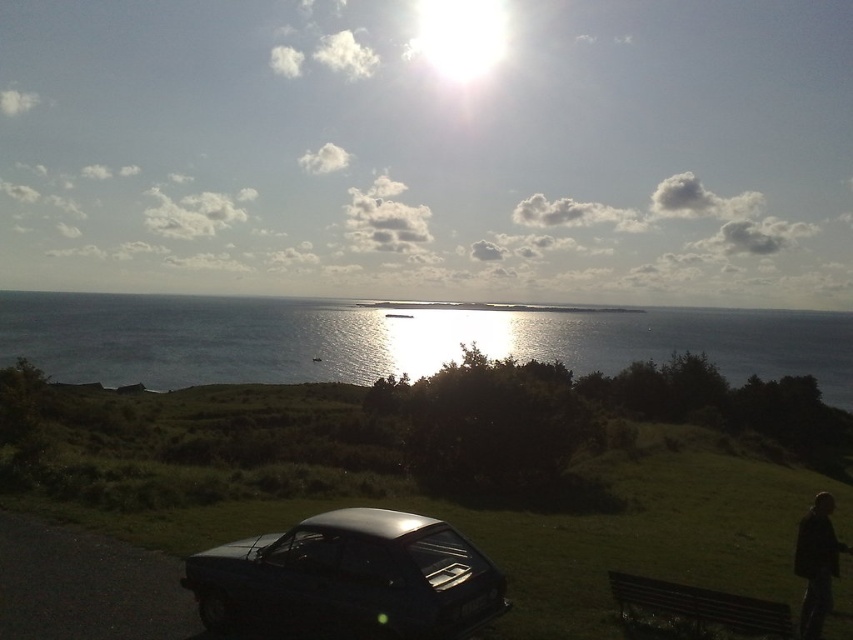
You are standing at the point marked by the coordinates point (393, 339) in the image. What do you see directly in front of you?

You see blue water at center directly in front of you at point (393, 339).

You are a photographer setting up a tripod to capture the sunset. You have a blue water at center and a dark brown wooden bench at lower right in your viewfinder. Which object should you focus on first if you want to ensure both are in focus without moving the tripod?

The dark brown wooden bench at lower right should be focused on first because it is closer to the camera than the blue water at center, which is farther away. By focusing on the closer object, the farther one will also be in focus due to the depth of field.